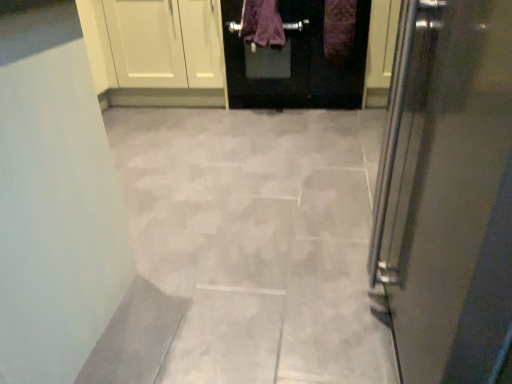
Question: From a real-world perspective, is purple fuzzy blanket at upper center, the 1th blanket positioned from the right, positioned over purple fabric at center, which is the first blanket in left-to-right order, based on gravity?

Choices:
 (A) no
 (B) yes

Answer: (A)

Question: Is purple fuzzy blanket at upper center, the second blanket from the left, behind purple fabric at center, which appears as the second blanket when viewed from the right?

Choices:
 (A) no
 (B) yes

Answer: (A)

Question: Does purple fuzzy blanket at upper center, the 1th blanket positioned from the right, have a greater height compared to purple fabric at center, which appears as the second blanket when viewed from the right?

Choices:
 (A) yes
 (B) no

Answer: (A)

Question: Does purple fuzzy blanket at upper center, the 1th blanket positioned from the right, have a greater width compared to purple fabric at center, which is the first blanket in left-to-right order?

Choices:
 (A) yes
 (B) no

Answer: (B)

Question: Is purple fuzzy blanket at upper center, the second blanket from the left, not close to purple fabric at center, which appears as the second blanket when viewed from the right?

Choices:
 (A) no
 (B) yes

Answer: (A)

Question: Based on their sizes in the image, would you say gray stone tile at center is bigger or smaller than purple fabric at center, which appears as the second blanket when viewed from the right?

Choices:
 (A) big
 (B) small

Answer: (A)

Question: In terms of width, does gray stone tile at center look wider or thinner when compared to purple fabric at center, which is the first blanket in left-to-right order?

Choices:
 (A) wide
 (B) thin

Answer: (A)

Question: From the image's perspective, is gray stone tile at center positioned above or below purple fabric at center, which appears as the second blanket when viewed from the right?

Choices:
 (A) below
 (B) above

Answer: (A)

Question: Would you say gray stone tile at center is inside or outside purple fabric at center, which appears as the second blanket when viewed from the right?

Choices:
 (A) inside
 (B) outside

Answer: (B)

Question: Looking at the image, does purple fabric at center, which is the first blanket in left-to-right order, seem bigger or smaller compared to purple fuzzy blanket at upper center, the 1th blanket positioned from the right?

Choices:
 (A) big
 (B) small

Answer: (A)

Question: Do you think purple fabric at center, which appears as the second blanket when viewed from the right, is within purple fuzzy blanket at upper center, the second blanket from the left, or outside of it?

Choices:
 (A) inside
 (B) outside

Answer: (B)

Question: From the image's perspective, is purple fabric at center, which is the first blanket in left-to-right order, located above or below purple fuzzy blanket at upper center, the 1th blanket positioned from the right?

Choices:
 (A) below
 (B) above

Answer: (B)

Question: From a real-world perspective, is purple fabric at center, which is the first blanket in left-to-right order, physically located above or below purple fuzzy blanket at upper center, the second blanket from the left?

Choices:
 (A) above
 (B) below

Answer: (A)

Question: Looking at their shapes, would you say purple fabric at center, which is the first blanket in left-to-right order, is wider or thinner than gray stone tile at center?

Choices:
 (A) wide
 (B) thin

Answer: (B)

Question: Is point (266, 13) positioned closer to the camera than point (371, 163)?

Choices:
 (A) closer
 (B) farther

Answer: (B)